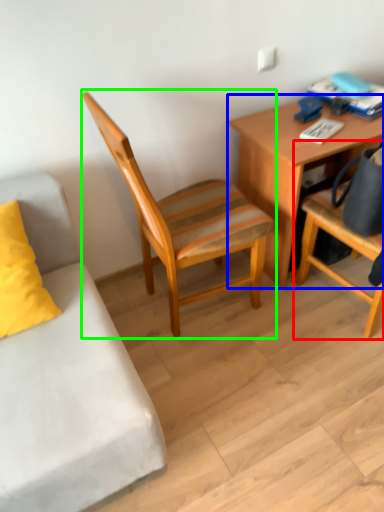
Question: Which is farther away from chair (highlighted by a red box)? desk (highlighted by a blue box) or chair (highlighted by a green box)?

Choices:
 (A) desk
 (B) chair

Answer: (B)